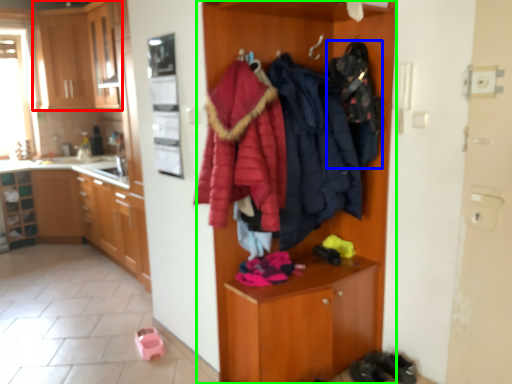
Question: Considering the real-world distances, which object is farthest from cabinetry (highlighted by a red box)? clothing (highlighted by a blue box) or dresser (highlighted by a green box)?

Choices:
 (A) clothing
 (B) dresser

Answer: (A)